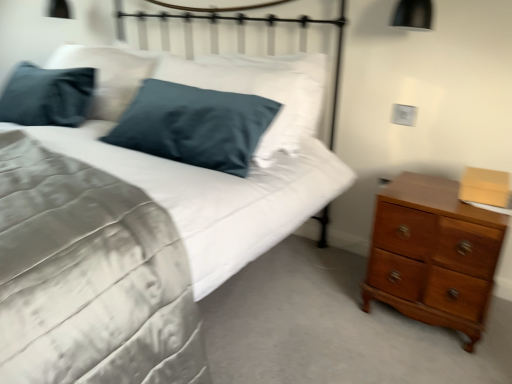
At what (x,y) coordinates should I click in order to perform the action: click on free space in front of shiny brown wooden chest of drawers at right. Please return your answer as a coordinate pair (x, y). This screenshot has height=384, width=512. Looking at the image, I should click on (429, 356).